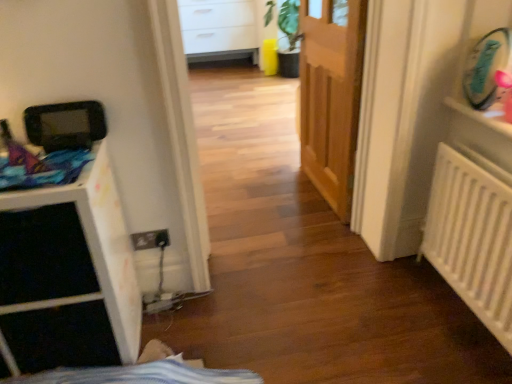
Question: Is point pyautogui.click(x=496, y=205) positioned closer to the camera than point pyautogui.click(x=323, y=66)?

Choices:
 (A) farther
 (B) closer

Answer: (B)

Question: Considering the positions of white matte radiator at right and wooden door at center in the image, is white matte radiator at right taller or shorter than wooden door at center?

Choices:
 (A) tall
 (B) short

Answer: (B)

Question: Based on their relative distances, which object is nearer to the white matte file cabinet at left?

Choices:
 (A) white plastic shelf at upper right
 (B) wooden door at center
 (C) white matte radiator at right

Answer: (C)

Question: Which is nearer to the white matte file cabinet at left?

Choices:
 (A) wooden door at center
 (B) white plastic shelf at upper right
 (C) white matte radiator at right

Answer: (C)